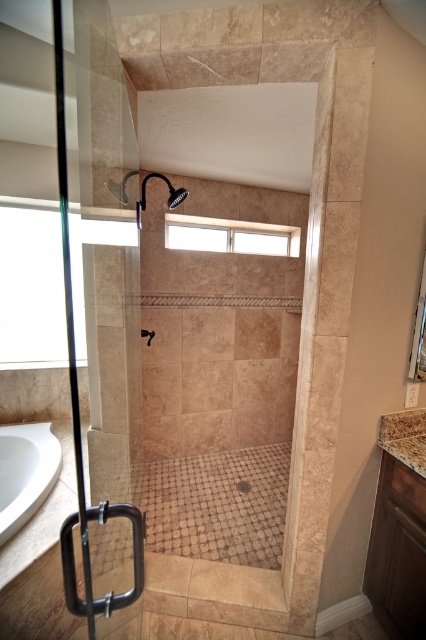
Question: Based on their relative distances, which object is nearer to the clear glass window at upper center?

Choices:
 (A) white glossy bathtub at lower left
 (B) transparent glass door at left

Answer: (B)

Question: Which of the following is the closest to the observer?

Choices:
 (A) matte black shower head at upper center
 (B) clear glass window at upper center

Answer: (A)

Question: Based on their relative distances, which object is farther from the clear glass window at upper center?

Choices:
 (A) transparent glass door at left
 (B) marble countertop at lower right
 (C) matte black shower head at upper center
 (D) white glossy bathtub at lower left

Answer: (B)

Question: Does white glossy bathtub at lower left lie behind clear glass window at upper center?

Choices:
 (A) no
 (B) yes

Answer: (A)

Question: Can you confirm if transparent glass door at left is positioned below white glossy bathtub at lower left?

Choices:
 (A) yes
 (B) no

Answer: (B)

Question: Is transparent glass door at left further to camera compared to clear glass window at upper center?

Choices:
 (A) no
 (B) yes

Answer: (A)